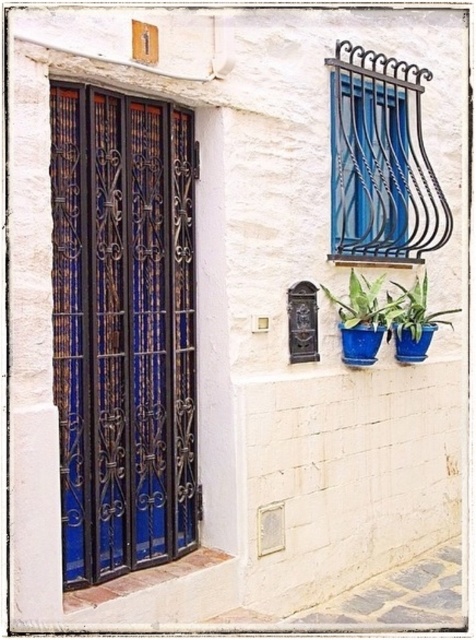
You are a painter standing at the base of the building. You need to paint the wrought iron window frame at upper right and the blue glossy pot at center. Which object will require you to use a taller ladder?

The wrought iron window frame at upper right requires a taller ladder since it has a greater height compared to the blue glossy pot at center.

Looking at this image, you are standing in front of a white building with a dark blue metal grille and a black mailbox. There are flowerpots below the mailbox. If you walk towards the blue matte metal door at left, which is marked by the point at coordinates (122, 330), will you pass by the black mailbox on your right or left side?

The point at coordinates (122, 330) marks the blue matte metal door at left. Since the black mailbox is to the right of the grille, walking towards the door would mean the mailbox is on your right side.

You are standing in front of the white building and notice a point marked at coordinates (122, 330). Based on the scene description, which object is this point located on?

The point at coordinates (122, 330) is located on the blue matte metal door at left.